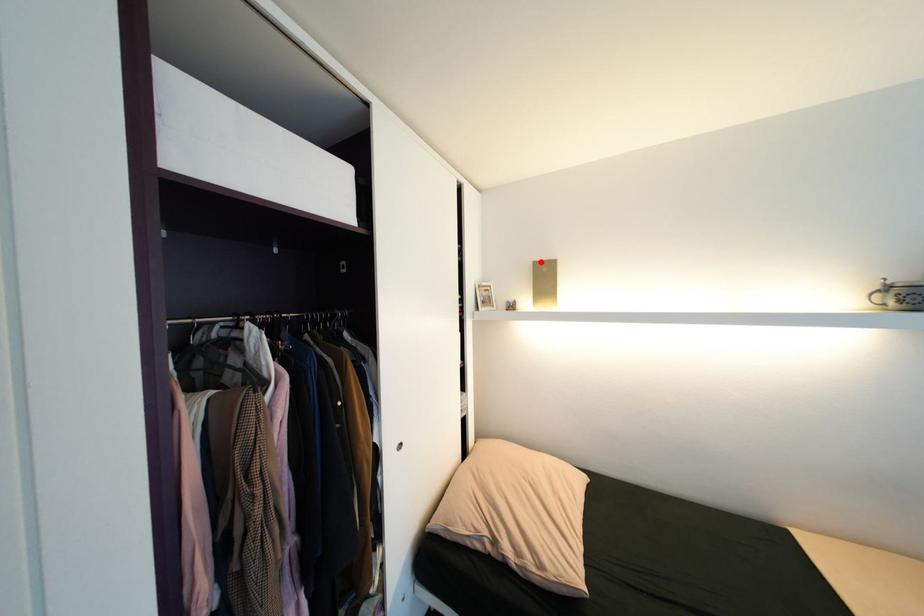
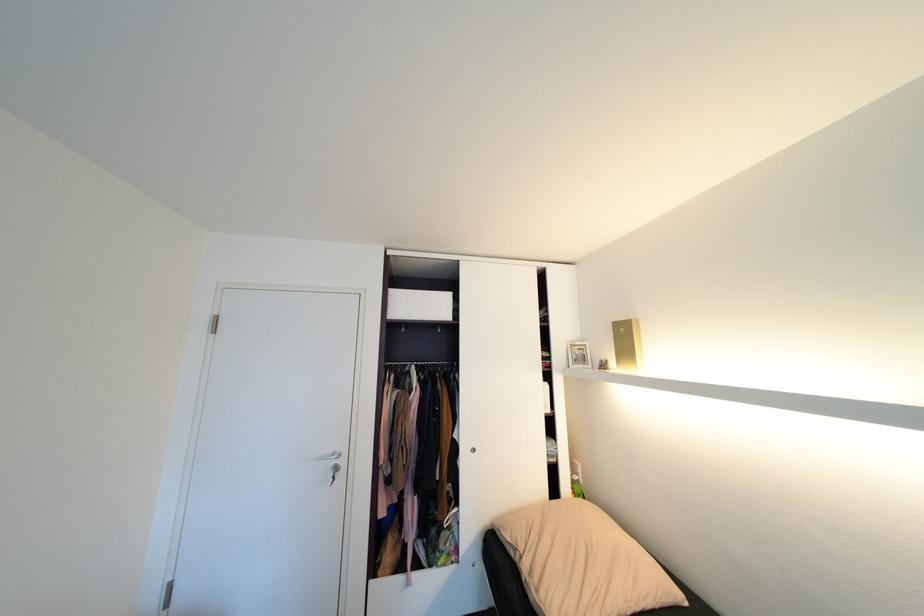
The point at the highlighted location is marked in the first image. Where is the corresponding point in the second image?

(621, 323)